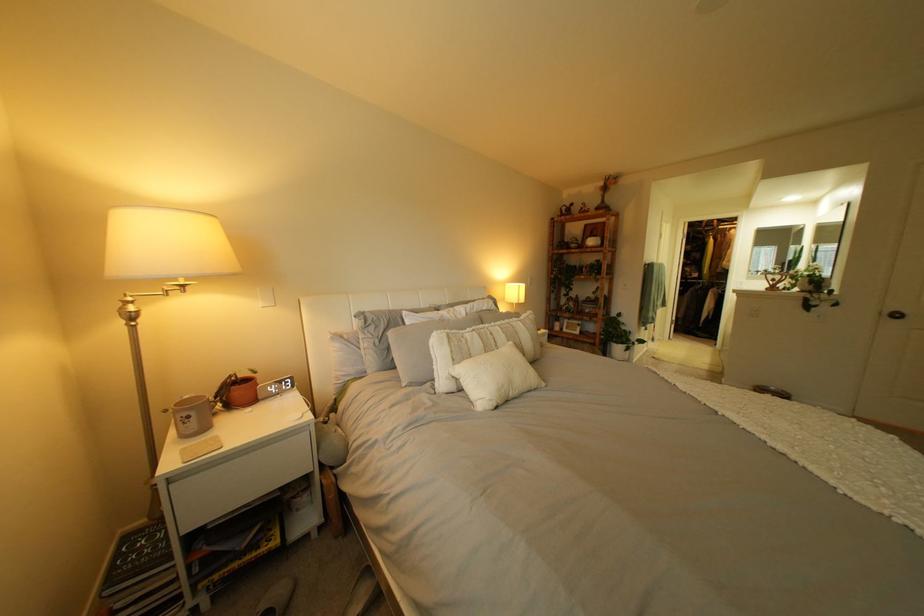
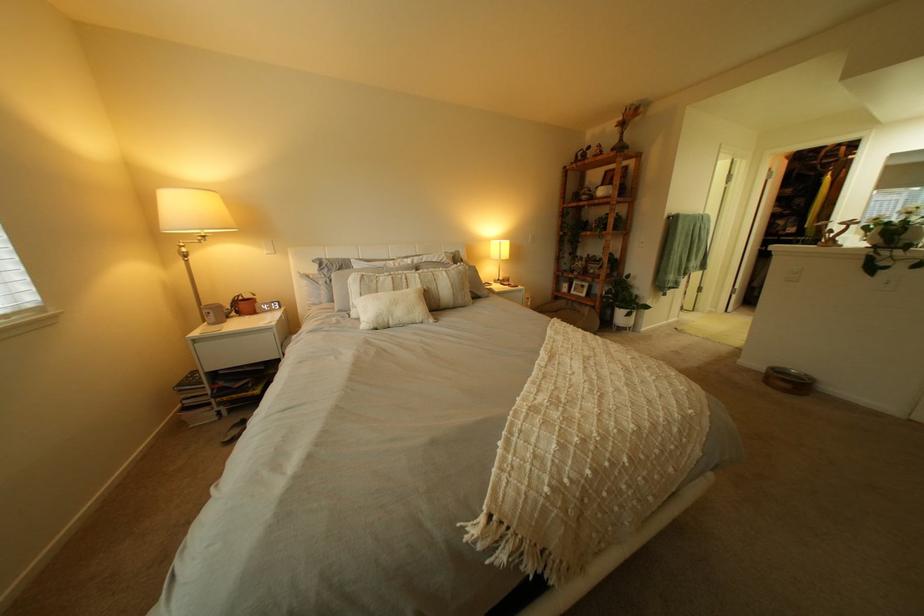
Find the pixel in the second image that matches point 518,337 in the first image.

(434, 283)